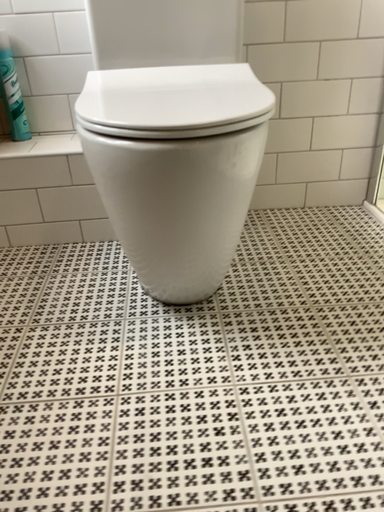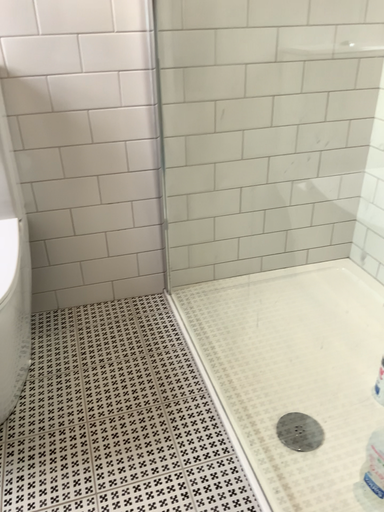
Question: Which way did the camera rotate in the video?

Choices:
 (A) rotated left
 (B) rotated right

Answer: (B)